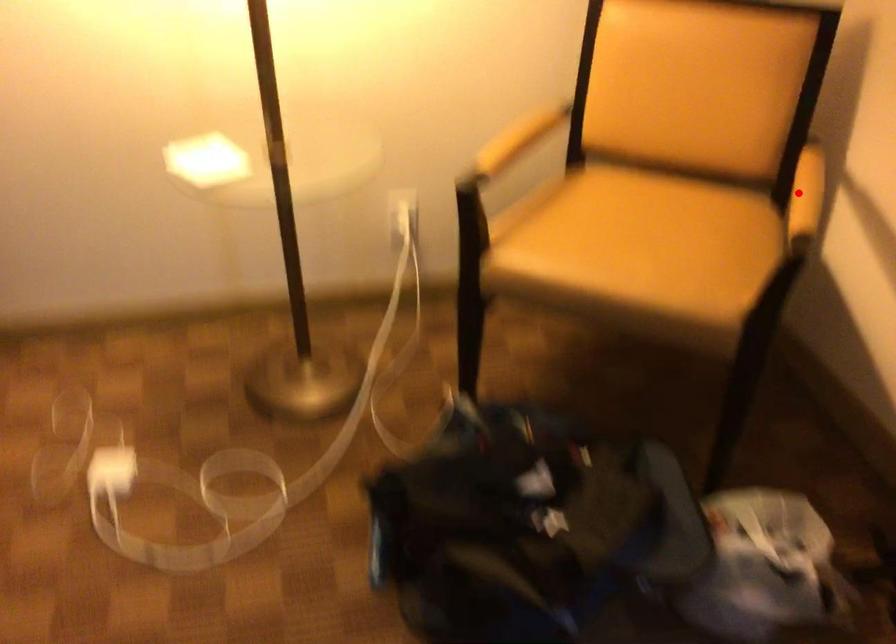
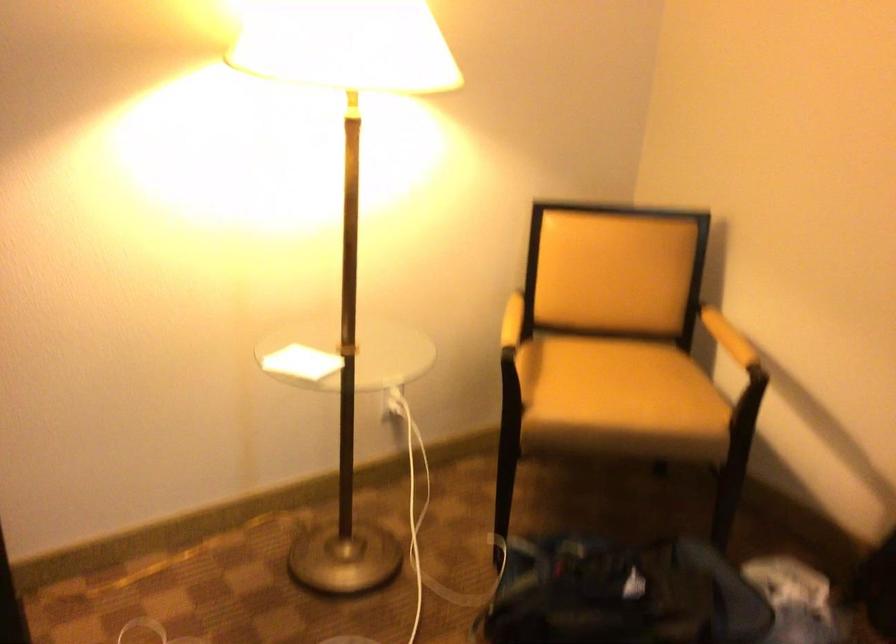
Question: I am providing you with two images of the same scene from different viewpoints. Image1 has a red point marked. In image2, the corresponding 3D location appears at what relative position? Reply with the corresponding letter.

Choices:
 (A) Closer
 (B) Farther

Answer: (B)